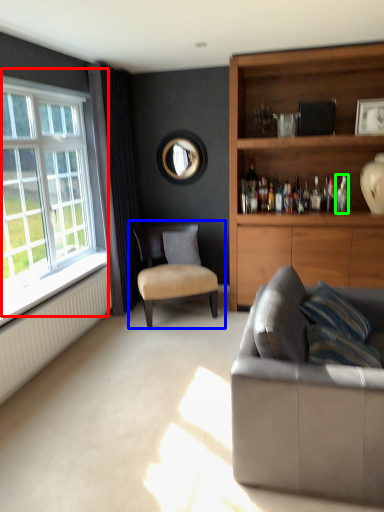
Question: Which is nearer to the window (highlighted by a red box)? chair (highlighted by a blue box) or bottle (highlighted by a green box).

Choices:
 (A) chair
 (B) bottle

Answer: (A)